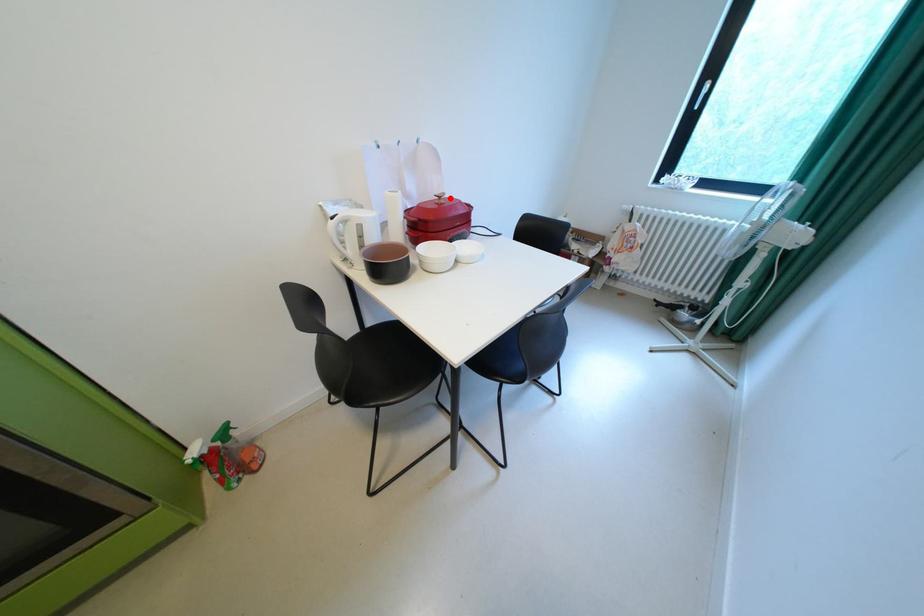
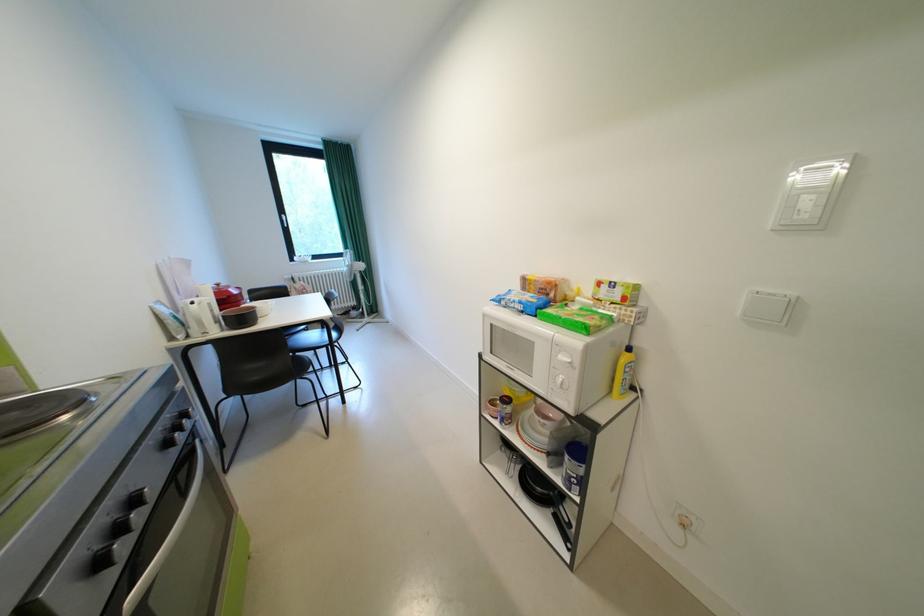
In the second image, find the point that corresponds to the highlighted location in the first image.

(228, 286)